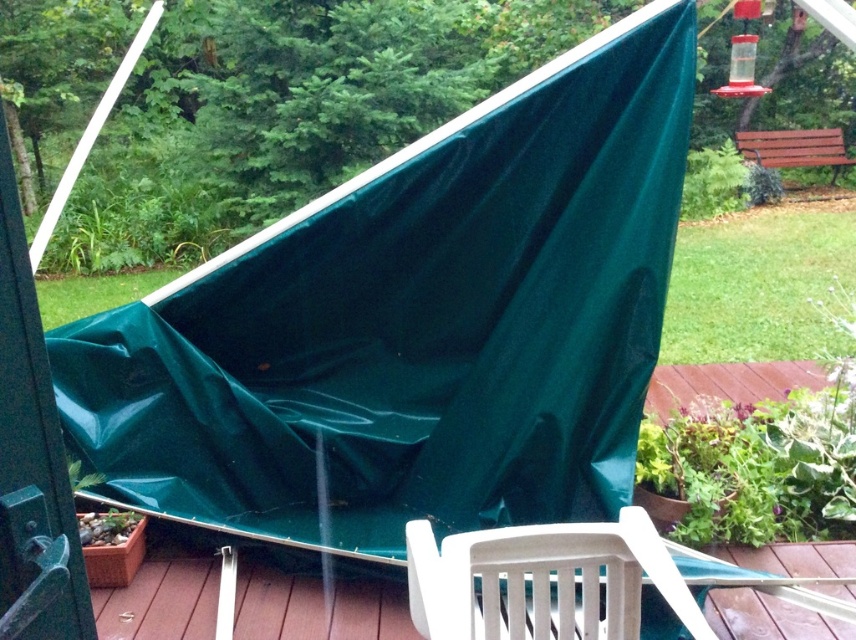
You are standing at the point labeled point (x=207, y=564) on the wooden deck. A white plastic chair is nearby. Can you reach the chair without moving more than 7 feet?

The distance between you and the point labeled point (x=207, y=564) is 7.80 feet. Since 7.80 feet is more than 7 feet, you cannot reach the chair without moving more than 7 feet.

You are planning to place a new potted plant on the deck. Given the current setup with the brown wood deck at lower center and the green tarp at left, where should you place the potted plant to ensure it stays dry during rain?

The brown wood deck at lower center is positioned under the green tarp at left, so placing the potted plant on the brown wood deck at lower center would keep it dry under the tarp during rain.